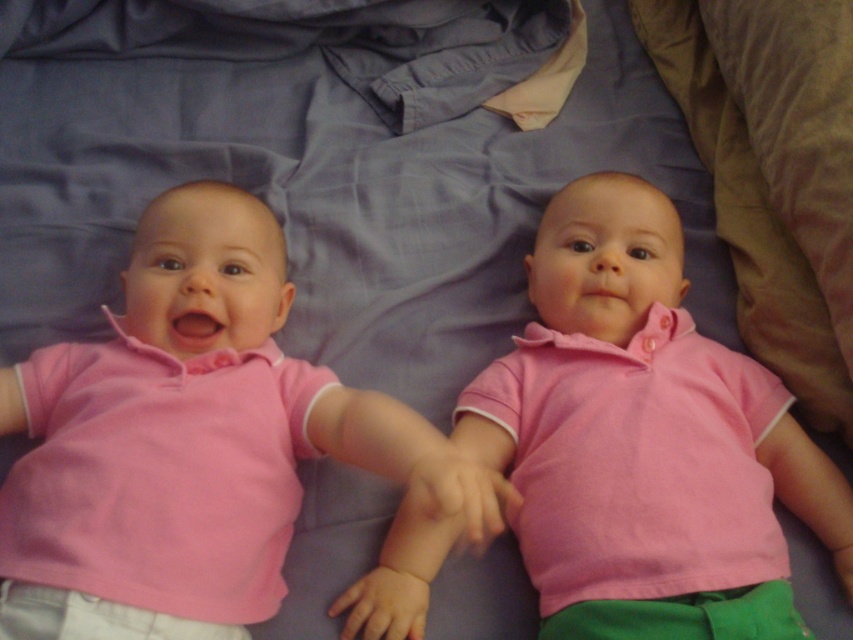
Is matte pink shirt at center shorter than pink cotton shirt at center?

Yes.

Is point (274, 284) farther from camera compared to point (730, 428)?

Yes, point (274, 284) is behind point (730, 428).

At what (x,y) coordinates should I click in order to perform the action: click on matte pink shirt at center. Please return your answer as a coordinate pair (x, y). This screenshot has height=640, width=853. Looking at the image, I should click on (190, 444).